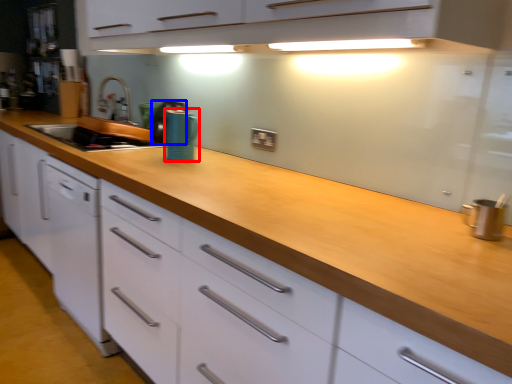
Question: Which of the following is the closest to the observer, appliance (highlighted by a red box) or appliance (highlighted by a blue box)?

Choices:
 (A) appliance
 (B) appliance

Answer: (A)